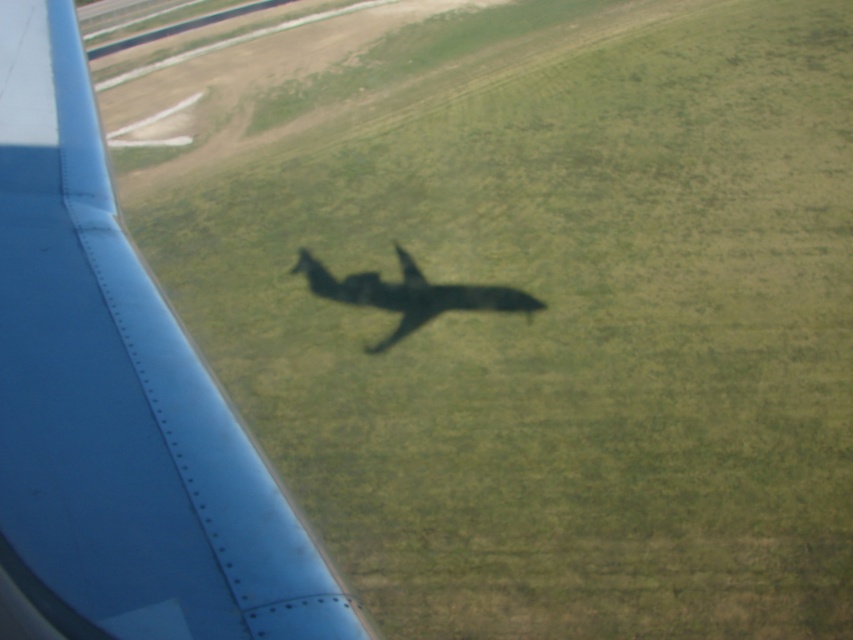
Who is positioned more to the right, matte blue wing at left or shiny metallic airplane at center?

Positioned to the right is matte blue wing at left.

Is matte blue wing at left thinner than shiny metallic airplane at center?

Yes, matte blue wing at left is thinner than shiny metallic airplane at center.

Is point (35, 4) in front of point (372, 280)?

Yes, it is.

Identify the location of matte blue wing at left. (119, 401).